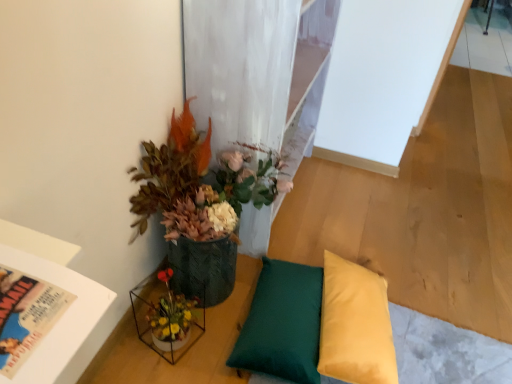
Question: Should I look upward or downward to see textured green pot at upper left?

Choices:
 (A) down
 (B) up

Answer: (A)

Question: Considering the relative sizes of yellow fabric pillow at lower right, which is the second pillow in left-to-right order, and textured green pot at upper left in the image provided, is yellow fabric pillow at lower right, which is the second pillow in left-to-right order, bigger than textured green pot at upper left?

Choices:
 (A) yes
 (B) no

Answer: (B)

Question: Is yellow fabric pillow at lower right, which is the second pillow in left-to-right order, shorter than textured green pot at upper left?

Choices:
 (A) yes
 (B) no

Answer: (A)

Question: Is yellow fabric pillow at lower right, acting as the 1th pillow starting from the right, smaller than textured green pot at upper left?

Choices:
 (A) no
 (B) yes

Answer: (B)

Question: From a real-world perspective, is yellow fabric pillow at lower right, which is the second pillow in left-to-right order, over textured green pot at upper left?

Choices:
 (A) yes
 (B) no

Answer: (B)

Question: From the image's perspective, does yellow fabric pillow at lower right, acting as the 1th pillow starting from the right, appear lower than textured green pot at upper left?

Choices:
 (A) yes
 (B) no

Answer: (A)

Question: Could you tell me if yellow fabric pillow at lower right, acting as the 1th pillow starting from the right, is facing textured green pot at upper left?

Choices:
 (A) yes
 (B) no

Answer: (B)

Question: Does translucent glass vase at lower left appear on the right side of textured green pot at upper left?

Choices:
 (A) no
 (B) yes

Answer: (A)

Question: Is translucent glass vase at lower left taller than textured green pot at upper left?

Choices:
 (A) no
 (B) yes

Answer: (A)

Question: Does translucent glass vase at lower left come in front of textured green pot at upper left?

Choices:
 (A) no
 (B) yes

Answer: (A)

Question: Is translucent glass vase at lower left bigger than textured green pot at upper left?

Choices:
 (A) yes
 (B) no

Answer: (B)

Question: Is translucent glass vase at lower left not within textured green pot at upper left?

Choices:
 (A) yes
 (B) no

Answer: (A)

Question: Does translucent glass vase at lower left turn towards textured green pot at upper left?

Choices:
 (A) yes
 (B) no

Answer: (B)

Question: Is yellow fabric pillow at lower right, acting as the 1th pillow starting from the right, aimed at green fabric pillow at lower center, marked as the second pillow in a right-to-left arrangement?

Choices:
 (A) yes
 (B) no

Answer: (B)